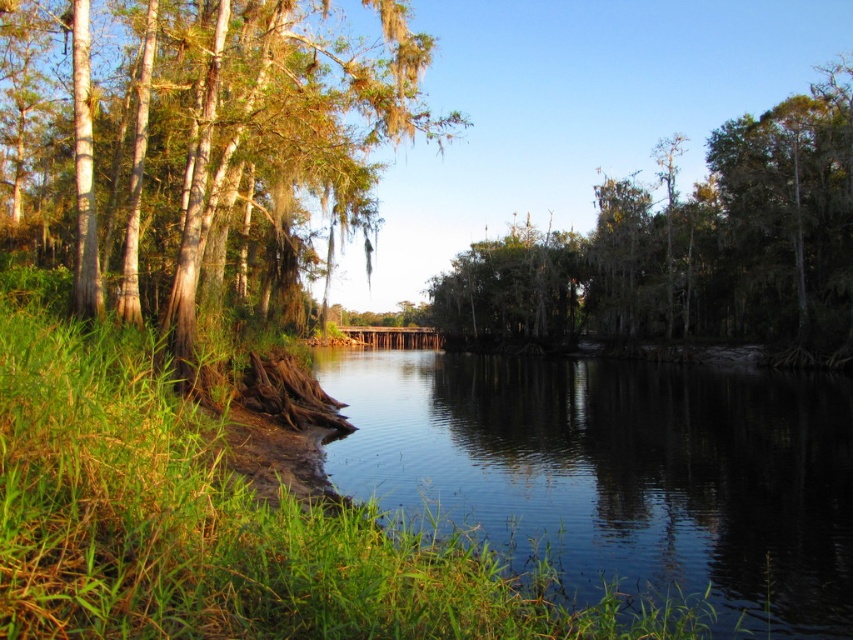
You are standing at the edge of the scene and want to cross to the other side. The clear water at center and the green mossy tree at center are in your path. Which one do you need to avoid stepping on to stay dry?

You need to avoid stepping on the green mossy tree at center because the clear water at center is wider and more likely to be a body of water you can walk around, while the tree is narrower and stepping on it might not keep you dry.

Consider the image. You are standing on the riverbank and want to take a photo of the green mossy tree at center without its reflection in the clear water at center. Where should you position yourself relative to the tree?

You should position yourself to the side of the green mossy tree at center so that the clear water at center is not directly in front of the tree, avoiding its reflection.

You are standing at the edge of the water and want to take a photo of the green mossy tree at left without the clear water at center appearing in the foreground. Is this possible based on the scene?

The clear water at center is in front of the green mossy tree at left, so if you are standing at the edge of the water, the clear water at center will be between you and the tree. Therefore, it would be difficult to take a photo of the green mossy tree at left without the clear water at center appearing in the foreground.